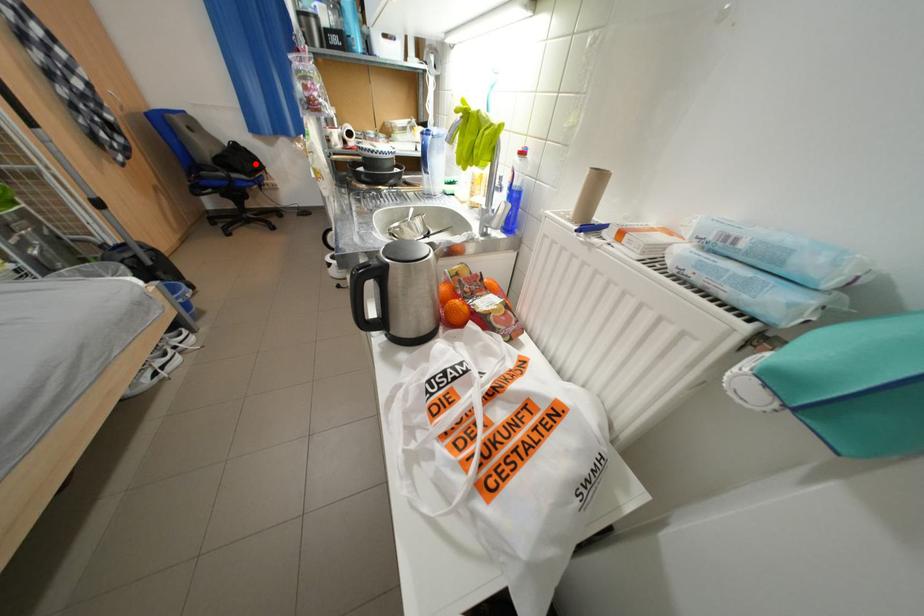
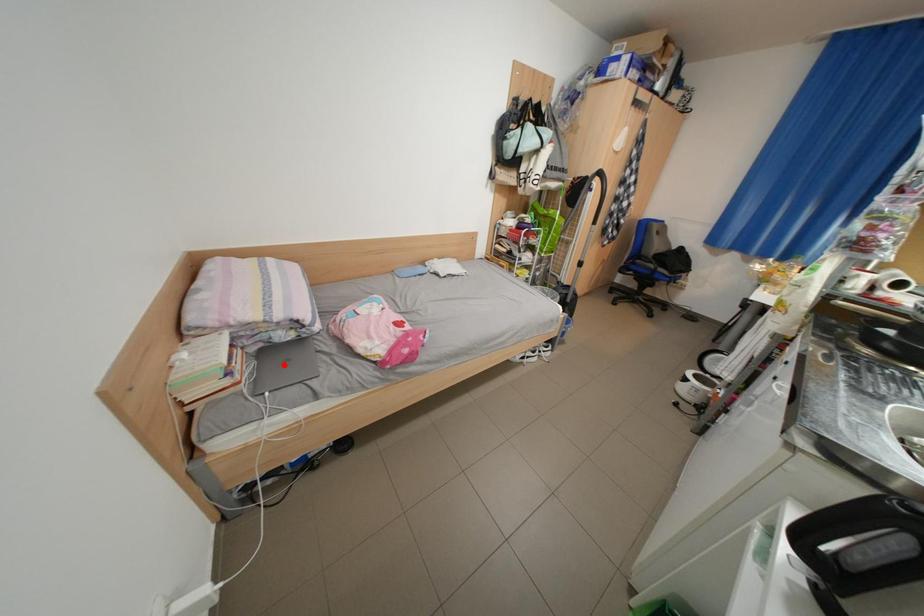
I am providing you with two images of the same scene from different viewpoints. A red point is marked on the first image and another point is marked on the second image. Do the highlighted points in image1 and image2 indicate the same real-world spot?

No